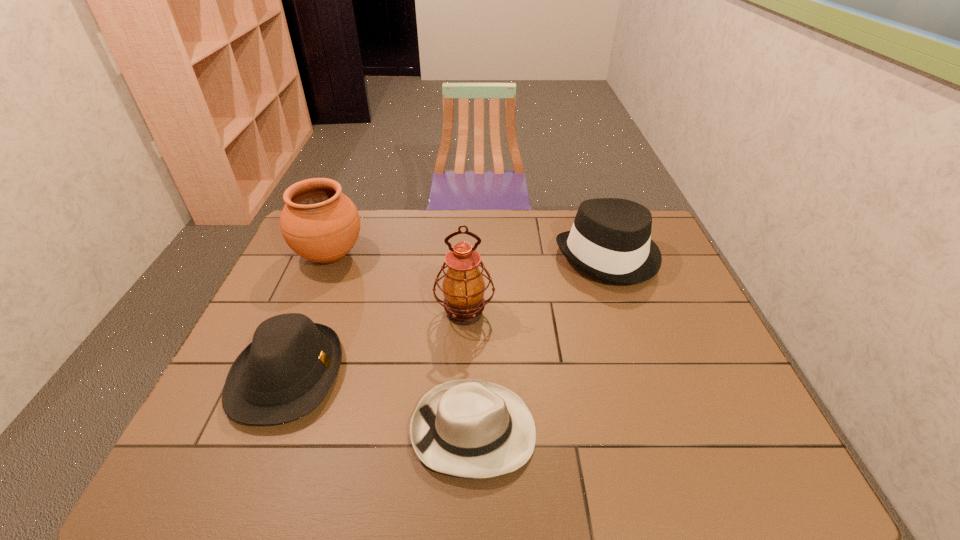
The width and height of the screenshot is (960, 540). Identify the location of oil lamp. (463, 287).

Find the location of a particular element. This screenshot has width=960, height=540. the second tallest object is located at coordinates (318, 222).

The image size is (960, 540). What are the coordinates of `the rightmost fedora` in the screenshot? It's located at (610, 239).

Locate an element on the screen. This screenshot has height=540, width=960. the tallest fedora is located at coordinates (610, 239).

This screenshot has height=540, width=960. What are the coordinates of `the fourth tallest object` in the screenshot? It's located at (286, 371).

This screenshot has width=960, height=540. In order to click on the second tallest fedora in this screenshot , I will do `click(286, 371)`.

The width and height of the screenshot is (960, 540). I want to click on the second fedora from left to right, so click(x=469, y=428).

In order to click on the shortest fedora in this screenshot , I will do `click(469, 428)`.

Locate an element on the screen. free space located 0.310m on the back of the oil lamp is located at coordinates (468, 233).

Locate an element on the screen. Image resolution: width=960 pixels, height=540 pixels. free region located 0.070m on the front of the pottery is located at coordinates (314, 294).